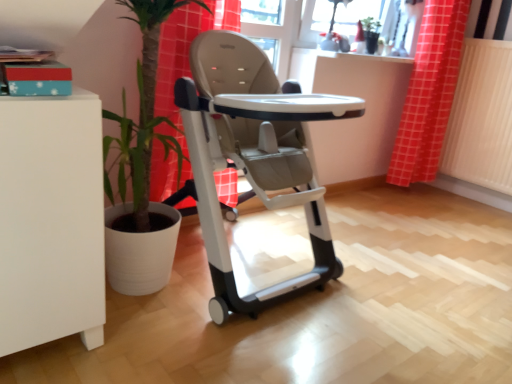
Question: Is red checkered curtain at upper right turned away from matte glass window screen at upper center?

Choices:
 (A) no
 (B) yes

Answer: (A)

Question: Does red checkered curtain at upper right have a lesser width compared to matte glass window screen at upper center?

Choices:
 (A) no
 (B) yes

Answer: (A)

Question: Is matte glass window screen at upper center completely or partially inside red checkered curtain at upper right?

Choices:
 (A) no
 (B) yes

Answer: (A)

Question: Considering the relative sizes of red checkered curtain at upper right and matte glass window screen at upper center in the image provided, is red checkered curtain at upper right wider than matte glass window screen at upper center?

Choices:
 (A) yes
 (B) no

Answer: (A)

Question: Is there a large distance between red checkered curtain at upper right and matte glass window screen at upper center?

Choices:
 (A) no
 (B) yes

Answer: (A)

Question: Is red checkered curtain at upper right not within matte glass window screen at upper center?

Choices:
 (A) yes
 (B) no

Answer: (A)

Question: Would you say matte glass window screen at upper center contains red checkered curtain at upper right?

Choices:
 (A) no
 (B) yes

Answer: (A)

Question: Is the surface of matte glass window screen at upper center in direct contact with red checkered curtain at upper right?

Choices:
 (A) yes
 (B) no

Answer: (B)

Question: From a real-world perspective, is matte glass window screen at upper center located higher than red checkered curtain at upper right?

Choices:
 (A) yes
 (B) no

Answer: (A)

Question: Can you confirm if matte glass window screen at upper center is shorter than red checkered curtain at upper right?

Choices:
 (A) no
 (B) yes

Answer: (B)

Question: Can you confirm if matte glass window screen at upper center is thinner than red checkered curtain at upper right?

Choices:
 (A) no
 (B) yes

Answer: (B)

Question: Is matte glass window screen at upper center not within red checkered curtain at upper right?

Choices:
 (A) yes
 (B) no

Answer: (A)

Question: Is the surface of matte gray high chair at center in direct contact with matte glass window screen at upper center?

Choices:
 (A) yes
 (B) no

Answer: (B)